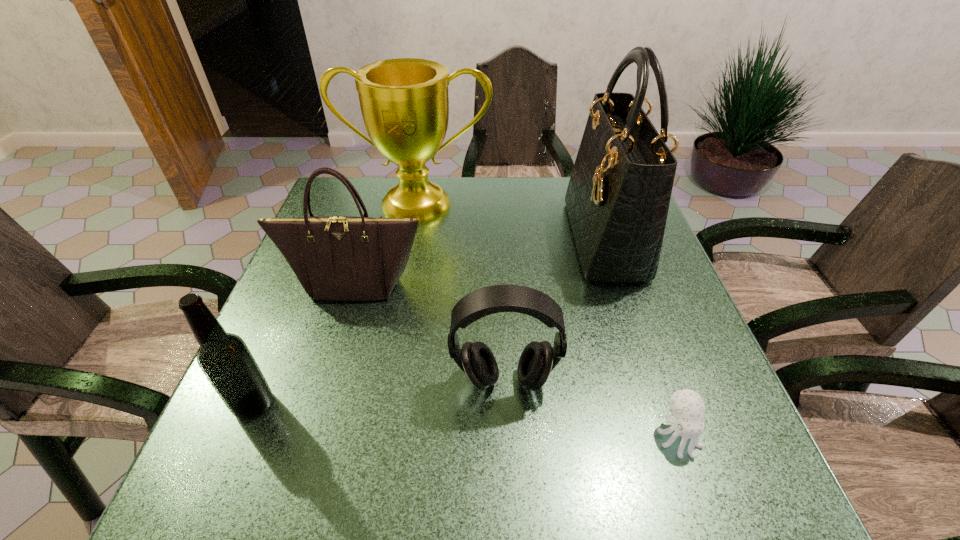
This screenshot has width=960, height=540. Identify the location of vacant region at the far left corner. (372, 180).

At what (x,y) coordinates should I click in order to perform the action: click on vacant space at the near right corner of the desktop. Please return your answer as a coordinate pair (x, y). The width and height of the screenshot is (960, 540). Looking at the image, I should click on (687, 461).

The height and width of the screenshot is (540, 960). I want to click on vacant space that's between the second shortest object and the shortest object, so click(591, 408).

Locate an element on the screen. free spot between the beer bottle and the right handbag is located at coordinates (429, 321).

The width and height of the screenshot is (960, 540). Identify the location of unoccupied position between the shorter handbag and the octopus. (516, 360).

Locate an element on the screen. Image resolution: width=960 pixels, height=540 pixels. empty space that is in between the fifth shortest object and the earphone is located at coordinates (462, 293).

The height and width of the screenshot is (540, 960). In order to click on vacant space that's between the shortest object and the beer bottle in this screenshot , I will do `click(466, 420)`.

Find the location of a particular element. vacant area that lies between the octopus and the beer bottle is located at coordinates (466, 420).

Locate an element on the screen. This screenshot has width=960, height=540. empty location between the right handbag and the fifth shortest object is located at coordinates (512, 222).

Locate an element on the screen. Image resolution: width=960 pixels, height=540 pixels. free space between the second shortest object and the fifth shortest object is located at coordinates pyautogui.click(x=462, y=293).